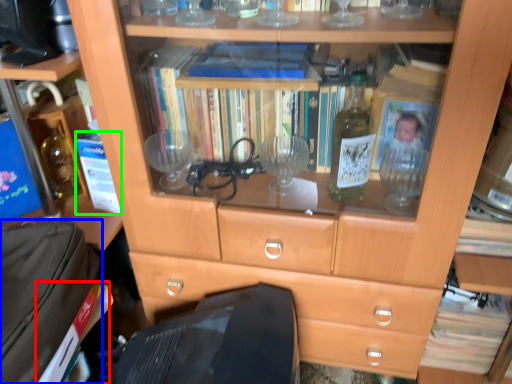
Question: Estimate the real-world distances between objects in this image. Which object is closer to paperback book (highlighted by a red box), luggage (highlighted by a blue box) or paperback book (highlighted by a green box)?

Choices:
 (A) luggage
 (B) paperback book

Answer: (A)